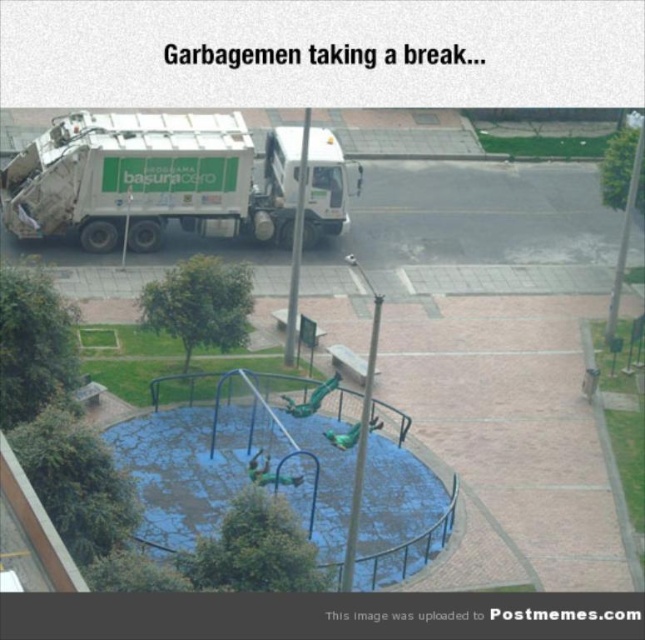
Question: Is white glossy garbage truck at left below blue cracked plastic at center?

Choices:
 (A) yes
 (B) no

Answer: (B)

Question: Which point appears farthest from the camera in this image?

Choices:
 (A) (166, 499)
 (B) (215, 125)

Answer: (B)

Question: Observing the image, what is the correct spatial positioning of white glossy garbage truck at left in reference to blue cracked plastic at center?

Choices:
 (A) below
 (B) above

Answer: (B)

Question: Which point appears farthest from the camera in this image?

Choices:
 (A) (188, 544)
 (B) (150, 218)

Answer: (B)

Question: Does white glossy garbage truck at left have a greater width compared to blue cracked plastic at center?

Choices:
 (A) yes
 (B) no

Answer: (A)